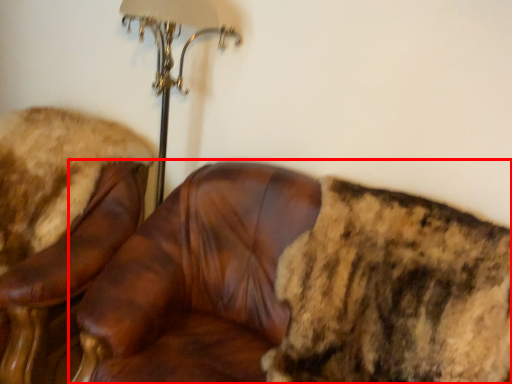
Question: From the image's perspective, what is the correct spatial positioning of chair (annotated by the red box) in reference to chair?

Choices:
 (A) below
 (B) above

Answer: (A)